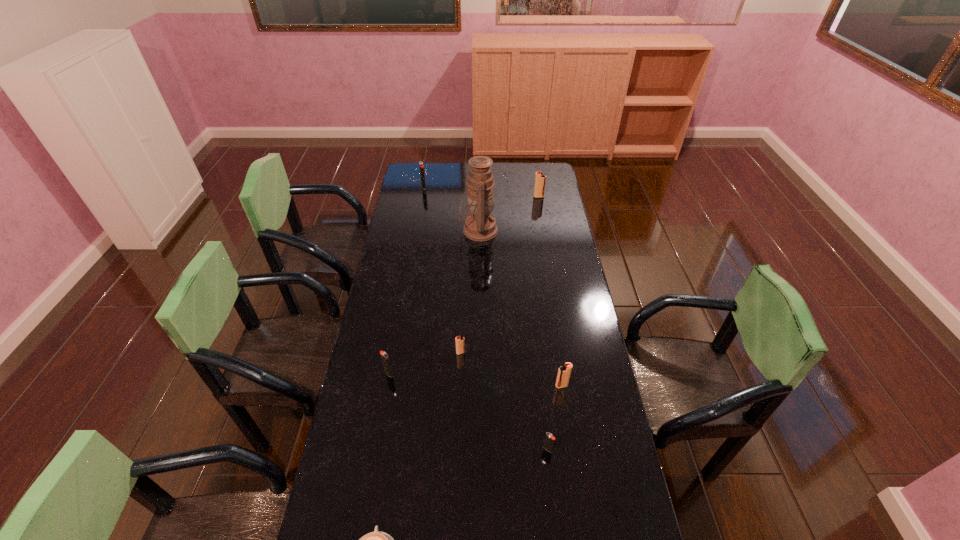
What are the coordinates of `free spot located 0.210m on the front of the rightmost black igniter` in the screenshot? It's located at (557, 529).

At what (x,y) coordinates should I click in order to perform the action: click on object located in the far edge section of the desktop. Please return your answer as a coordinate pair (x, y). The image size is (960, 540). Looking at the image, I should click on tap(421, 165).

You are a GUI agent. You are given a task and a screenshot of the screen. Output one action in this format:
    pyautogui.click(x=<x>, y=<y>)
    Task: Click on the object at the far left corner
    The height and width of the screenshot is (540, 960).
    Given the screenshot: What is the action you would take?
    pyautogui.click(x=421, y=165)

At what (x,y) coordinates should I click in order to perform the action: click on blank area at the far edge. Please return your answer as a coordinate pair (x, y). Looking at the image, I should click on (522, 184).

Identify the location of vacant region at the left edge. (375, 297).

Locate an element on the screen. Image resolution: width=960 pixels, height=540 pixels. vacant space at the right edge of the desktop is located at coordinates (570, 268).

The width and height of the screenshot is (960, 540). I want to click on vacant space at the far left corner of the desktop, so click(x=407, y=181).

You are a GUI agent. You are given a task and a screenshot of the screen. Output one action in this format:
    pyautogui.click(x=<x>, y=<y>)
    Task: Click on the vacant point located between the farthest igniter and the second biggest black igniter
    This screenshot has height=540, width=960.
    Given the screenshot: What is the action you would take?
    pyautogui.click(x=406, y=280)

Where is `free point between the second nearest black igniter and the seventh nearest object`? This screenshot has width=960, height=540. free point between the second nearest black igniter and the seventh nearest object is located at coordinates 464,285.

Identify the location of vacant area between the sixth nearest object and the smallest black igniter. click(x=514, y=340).